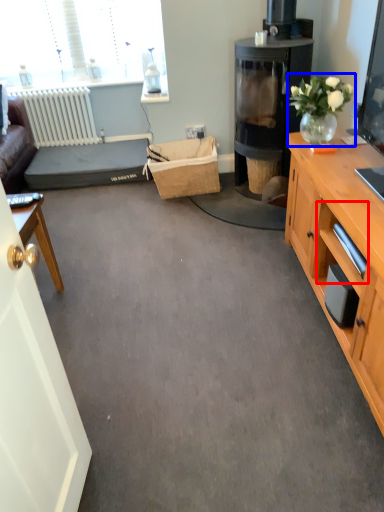
Question: Which object is further to the camera taking this photo, drawer (highlighted by a red box) or houseplant (highlighted by a blue box)?

Choices:
 (A) drawer
 (B) houseplant

Answer: (B)